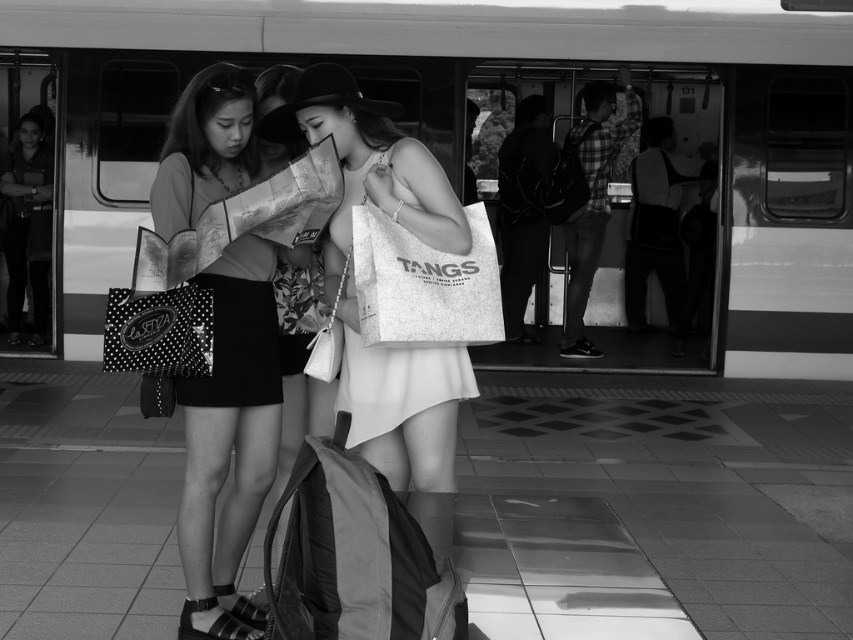
Between matte black skirt at center and white fabric bag at center, which one has more height?

Standing taller between the two is matte black skirt at center.

Which is in front, point (219, 330) or point (312, 93)?

Point (312, 93) is in front.

Find the location of a particular element. The width and height of the screenshot is (853, 640). matte black skirt at center is located at coordinates (229, 442).

Can you confirm if metallic silver train at center is bigger than white fabric bag at center?

No, metallic silver train at center is not bigger than white fabric bag at center.

Between metallic silver train at center and white fabric bag at center, which one has more height?

With more height is white fabric bag at center.

At what (x,y) coordinates should I click in order to perform the action: click on metallic silver train at center. Please return your answer as a coordinate pair (x, y). Looking at the image, I should click on (492, 141).

In the scene shown: Who is more forward, (x=366, y=456) or (x=363, y=220)?

Point (x=363, y=220)

Does white fabric bag at center appear on the left side of white paper bag at center?

Indeed, white fabric bag at center is positioned on the left side of white paper bag at center.

Does point (386, 390) lie in front of point (498, 312)?

That is False.

Locate an element on the screen. white fabric bag at center is located at coordinates (405, 417).